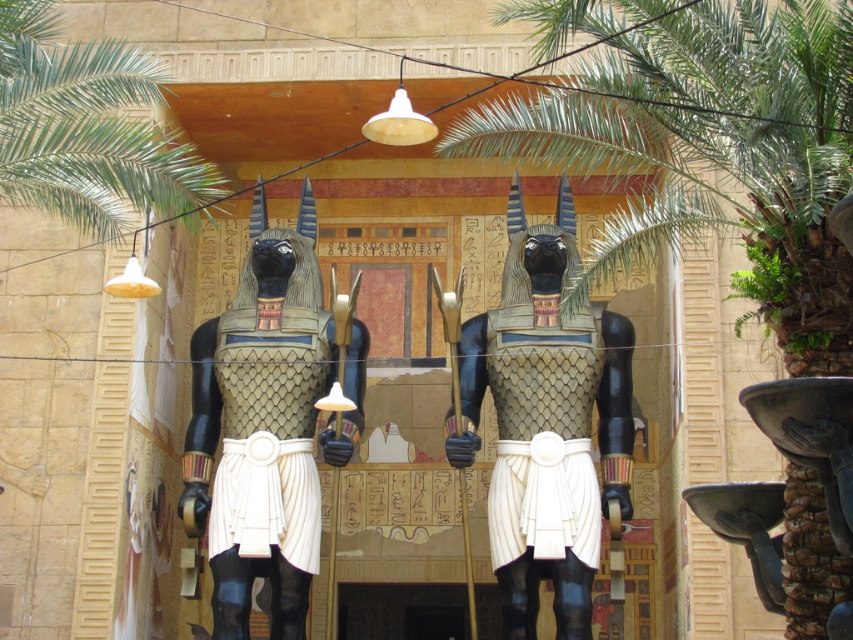
Between green leafy palm tree at center and matte gold armor at center, which one appears on the right side from the viewer's perspective?

green leafy palm tree at center

Describe the element at coordinates (714, 150) in the screenshot. I see `green leafy palm tree at center` at that location.

Is point (659, 241) positioned behind point (553, 609)?

Yes, point (659, 241) is farther from viewer.

This screenshot has height=640, width=853. I want to click on green leafy palm tree at center, so click(x=714, y=150).

Between matte gold armor at center and green leafy palm at upper left, which one has less height?

With less height is green leafy palm at upper left.

Measure the distance from matte gold armor at center to green leafy palm at upper left.

They are 21.95 meters apart.

Which is behind, point (538, 577) or point (32, 156)?

Point (538, 577)

The width and height of the screenshot is (853, 640). In order to click on matte gold armor at center in this screenshot , I will do `click(546, 422)`.

Is green leafy palm tree at center behind green leafy palm at upper left?

No.

Is point (770, 56) more distant than point (12, 173)?

No, it is not.

Who is more forward, (756,44) or (173,179)?

Point (756,44) is more forward.

Locate an element on the screen. This screenshot has width=853, height=640. green leafy palm tree at center is located at coordinates (714, 150).